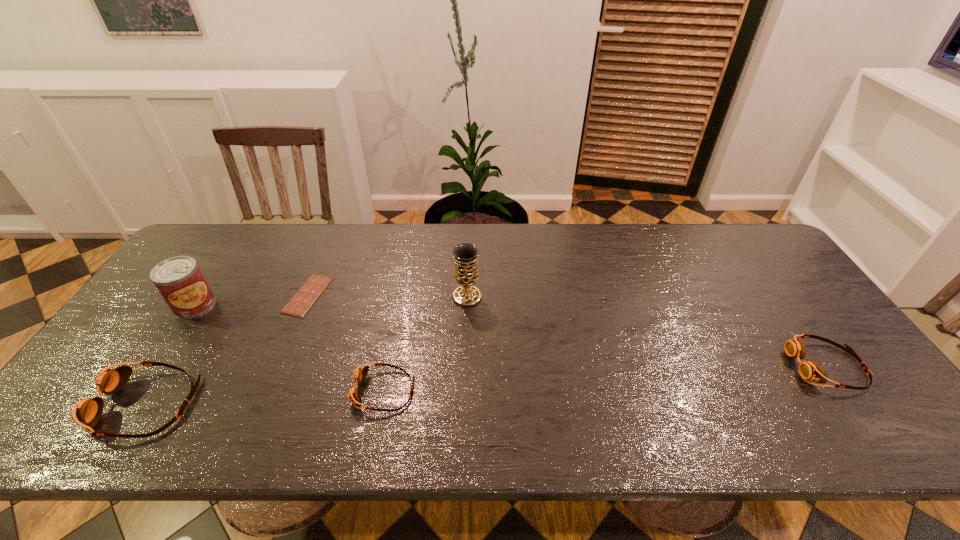
Image resolution: width=960 pixels, height=540 pixels. I want to click on the second object from right to left, so click(x=465, y=255).

The height and width of the screenshot is (540, 960). I want to click on vacant space located 0.350m with the lenses facing forward on the third object from right to left, so click(x=206, y=391).

Locate an element on the screen. free space located 0.120m with the lenses facing forward on the third object from right to left is located at coordinates (303, 391).

Where is `vacant space located 0.210m with the lenses facing forward on the third object from right to left`? The height and width of the screenshot is (540, 960). vacant space located 0.210m with the lenses facing forward on the third object from right to left is located at coordinates (266, 391).

Locate an element on the screen. This screenshot has width=960, height=540. free space located with the lenses facing forward on the rightmost object is located at coordinates (699, 366).

Locate an element on the screen. The height and width of the screenshot is (540, 960). free region located with the lenses facing forward on the rightmost object is located at coordinates (772, 366).

Find the location of a particular element. The height and width of the screenshot is (540, 960). vacant position located 0.370m with the lenses facing forward on the rightmost object is located at coordinates (643, 366).

Where is `free space located on the front of the can`? The image size is (960, 540). free space located on the front of the can is located at coordinates (168, 344).

Find the location of a particular element. Image resolution: width=960 pixels, height=540 pixels. free spot located on the right of the chocolate bar is located at coordinates (399, 295).

The width and height of the screenshot is (960, 540). I want to click on free point located on the left of the second object from right to left, so click(335, 296).